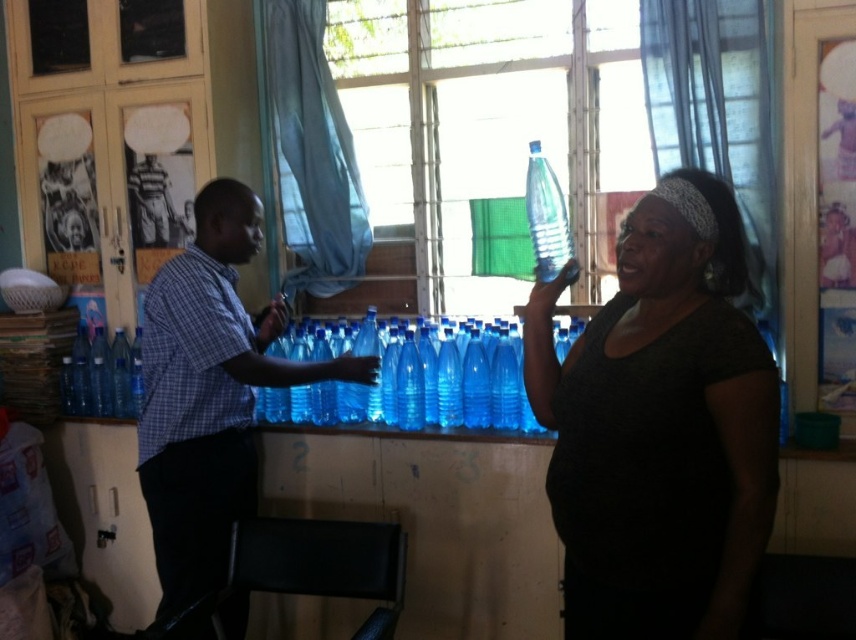
Between blue plastic water bottles at center and blue plastic bottle at center, which one appears on the right side from the viewer's perspective?

blue plastic water bottles at center is more to the right.

Who is positioned more to the left, blue plastic water bottles at center or blue plastic bottle at center?

blue plastic bottle at center

Between point (560, 410) and point (538, 145), which one is positioned in front?

Point (560, 410)

At what (x,y) coordinates should I click in order to perform the action: click on blue plastic water bottles at center. Please return your answer as a coordinate pair (x, y). The image size is (856, 640). Looking at the image, I should click on (660, 428).

Is point (621, 324) positioned before point (244, 467)?

Yes, point (621, 324) is closer to viewer.

Who is higher up, matte black shirt at center or matte blue water bottles at center?

matte black shirt at center is above.

What do you see at coordinates (660, 426) in the screenshot?
I see `matte black shirt at center` at bounding box center [660, 426].

Find the location of `matte black shirt at center`. matte black shirt at center is located at coordinates (660, 426).

I want to click on matte blue water bottles at center, so click(x=210, y=394).

Does matte blue water bottles at center appear under blue plastic bottle at center?

Yes.

Is point (164, 538) behind point (532, 240)?

That is False.

Where is `matte blue water bottles at center`? The image size is (856, 640). matte blue water bottles at center is located at coordinates (210, 394).